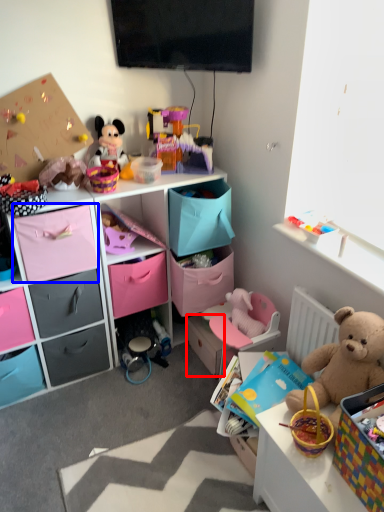
Question: Which object appears closest to the camera in this image, drawer (highlighted by a red box) or drawer (highlighted by a blue box)?

Choices:
 (A) drawer
 (B) drawer

Answer: (B)